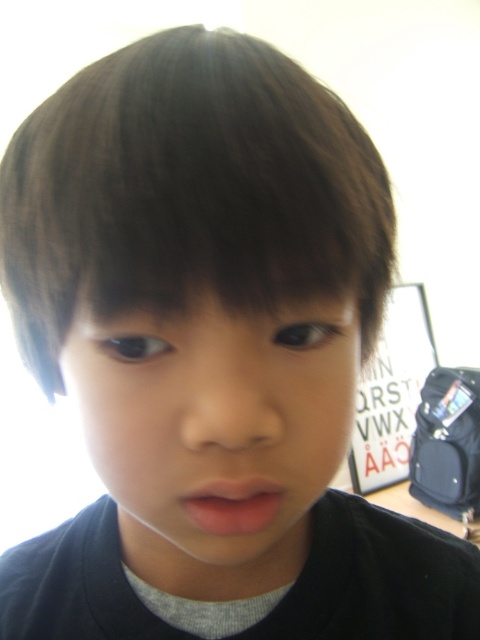
Based on the scene description, can you determine if the smooth skin face at center is wider than the pink matte lips at center?

The smooth skin face at center is wider than the pink matte lips at center according to the objects description.

You are standing in a classroom and see two points marked on the wall. The first point is at coordinates point (207, 342) and the second is at point (182, 500). Which point is closer to you?

Point (207, 342) is in front of point (182, 500), so it is closer to you.

Looking at the person in the image, which object is positioned to the left when comparing smooth skin face at center and pink matte lips at center?

The smooth skin face at center is positioned to the left of the pink matte lips at center.